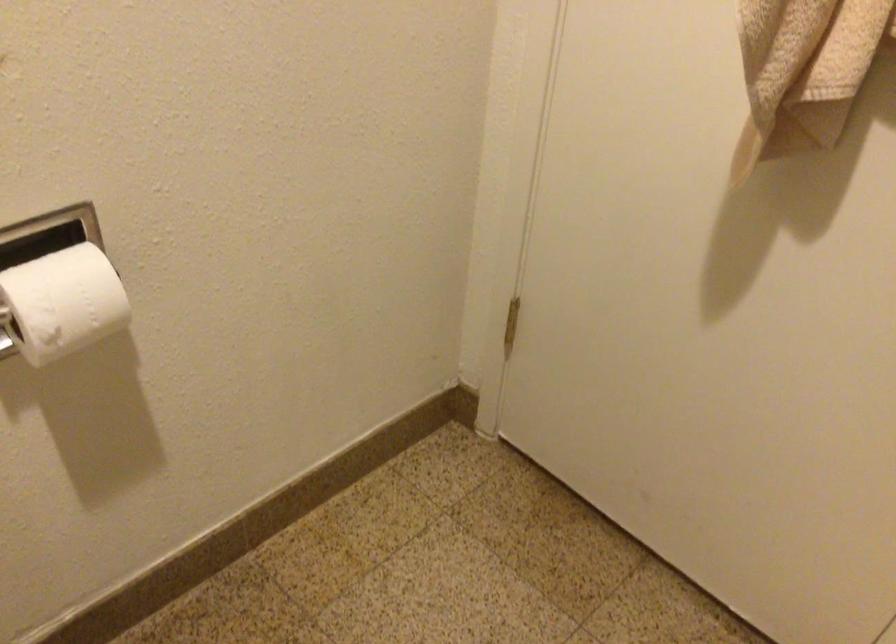
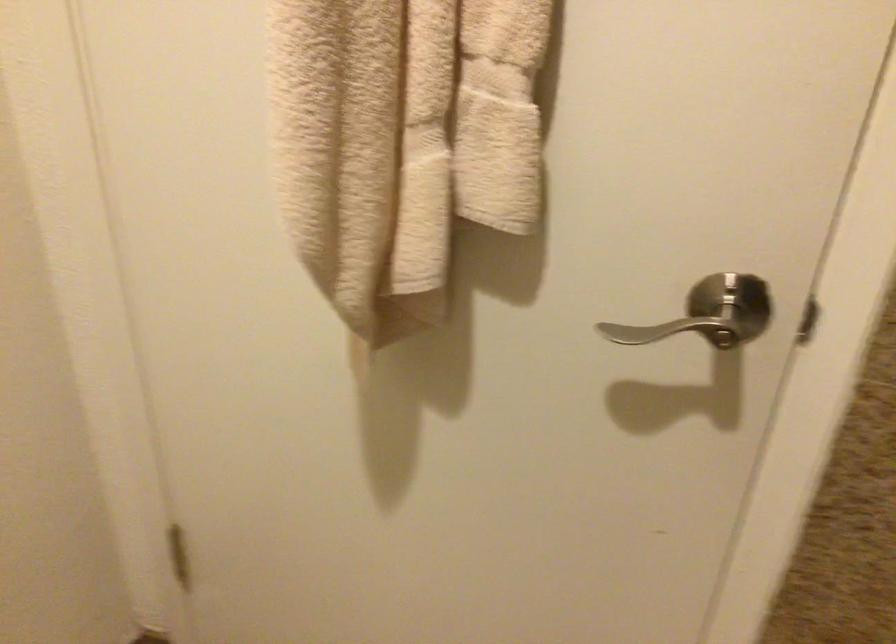
Question: How did the camera likely rotate?

Choices:
 (A) Left
 (B) Right
 (C) Up
 (D) Down

Answer: (B)